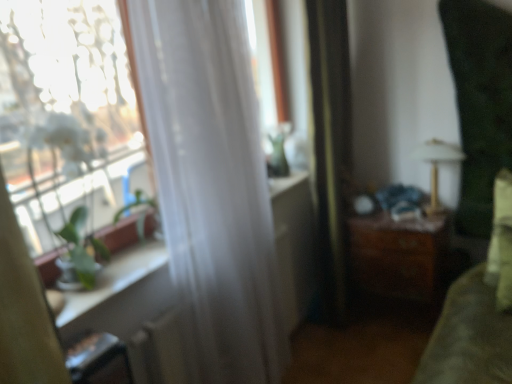
This screenshot has height=384, width=512. Identify the location of vacant region above wooden chest of drawers at center-right (from a real-world perspective). (391, 218).